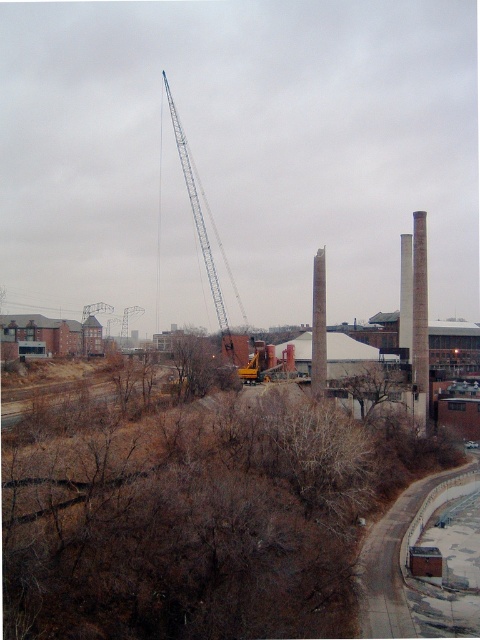
You are a delivery truck driver who needs to pass through the area between the gray concrete chimney at center and the metallic gray crane at center. Given that your truck is 2 meters wide, can you safely navigate through the space between them?

The gray concrete chimney at center is bigger than the metallic gray crane at center, but the description does not provide information about the distance between them. Therefore, it is impossible to determine if the truck can safely pass through the space between them based on the given information.

You are standing at the camera position and want to take a photo of the gray concrete chimney at center. Given that your camera has a maximum focus range of 100 meters, will you be able to capture the chimney in focus?

The gray concrete chimney at center and camera are 99.44 meters apart, so yes, you can capture the chimney in focus since the distance is within the camera maximum focus range of 100 meters.